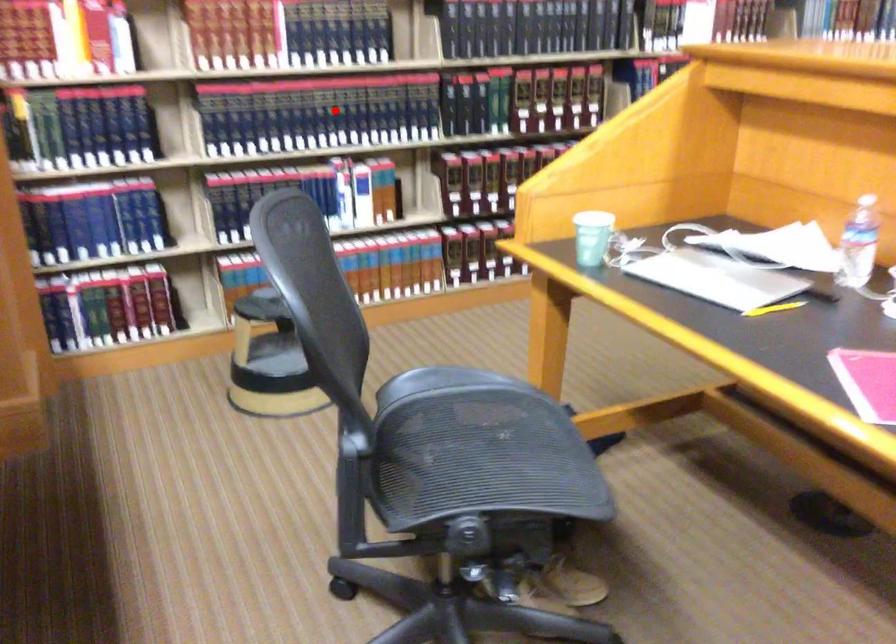
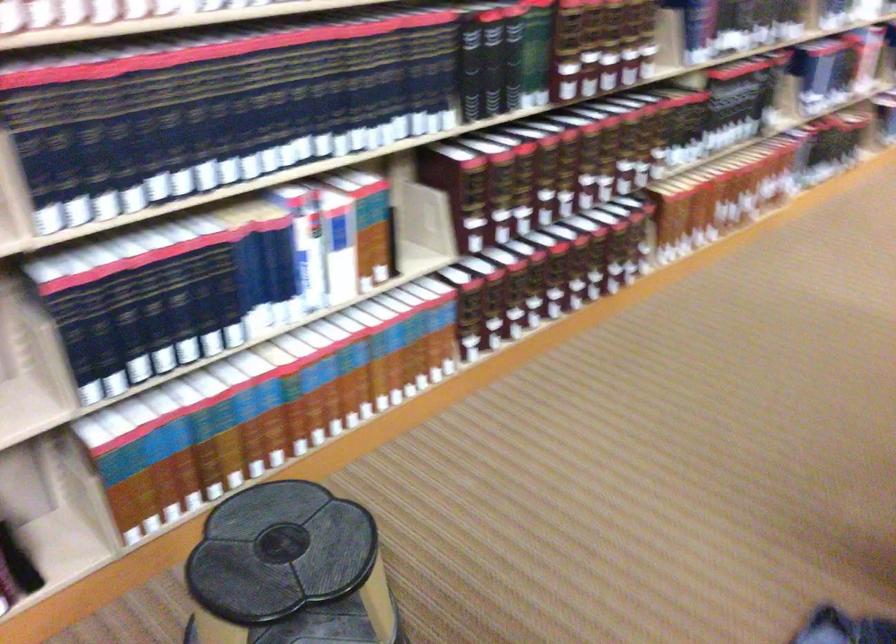
Locate, in the second image, the point that corresponds to the highlighted location in the first image.

(297, 104)